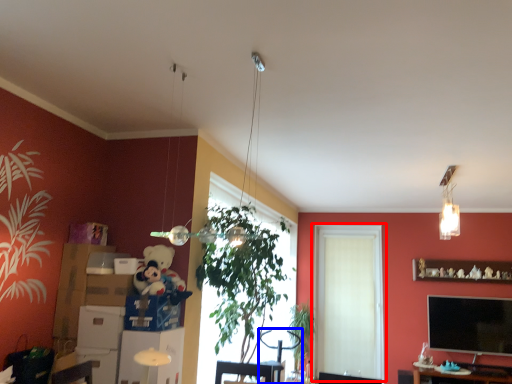
Question: Which of the following is the farthest to the observer, window (highlighted by a red box) or swivel chair (highlighted by a blue box)?

Choices:
 (A) window
 (B) swivel chair

Answer: (A)